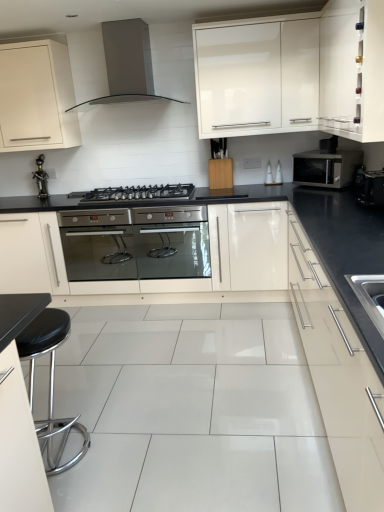
Question: From the image's perspective, is stainless steel oven at center positioned above or below metallic figurine at left?

Choices:
 (A) below
 (B) above

Answer: (A)

Question: Looking at the image, does stainless steel oven at center seem bigger or smaller compared to metallic figurine at left?

Choices:
 (A) small
 (B) big

Answer: (B)

Question: Which of these objects is positioned closest to the satin silver drawer at right, the third cabinetry positioned from the left?

Choices:
 (A) black plastic toaster at right
 (B) satin metallic range hood at upper center
 (C) wooden knife block at center, which appears as the third cabinetry when viewed from the right
 (D) stainless steel oven at center
 (E) white glossy cabinet at upper right, placed as the first cabinetry when sorted from right to left

Answer: (E)

Question: Which of these objects is positioned farthest from the satin silver microwave at right?

Choices:
 (A) satin silver drawer at right, the third cabinetry positioned from the left
 (B) black plastic toaster at right
 (C) stainless steel oven at center
 (D) white glossy cabinet at upper right, which is counted as the 4th cabinetry, starting from the left
 (E) metallic figurine at left

Answer: (E)